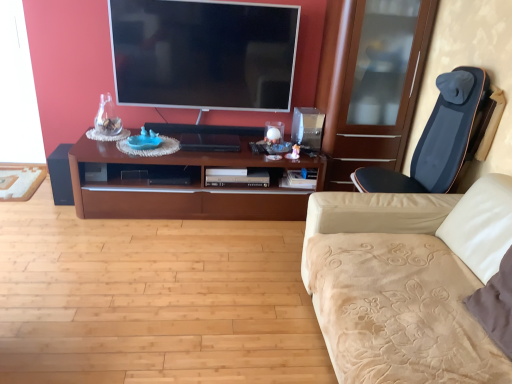
Question: From the image's perspective, would you say black matte speaker at left is positioned over dark blue fabric massage chair at right?

Choices:
 (A) no
 (B) yes

Answer: (A)

Question: Does black matte speaker at left have a lesser height compared to dark blue fabric massage chair at right?

Choices:
 (A) no
 (B) yes

Answer: (B)

Question: Can you confirm if black matte speaker at left is positioned to the right of dark blue fabric massage chair at right?

Choices:
 (A) no
 (B) yes

Answer: (A)

Question: Is dark blue fabric massage chair at right surrounded by black matte speaker at left?

Choices:
 (A) yes
 (B) no

Answer: (B)

Question: Is black matte speaker at left thinner than dark blue fabric massage chair at right?

Choices:
 (A) no
 (B) yes

Answer: (B)

Question: From a real-world perspective, is beige velvety studio couch at right above or below dark blue fabric massage chair at right?

Choices:
 (A) above
 (B) below

Answer: (B)

Question: Looking at the image, does beige velvety studio couch at right seem bigger or smaller compared to dark blue fabric massage chair at right?

Choices:
 (A) small
 (B) big

Answer: (B)

Question: Visually, is beige velvety studio couch at right positioned to the left or to the right of dark blue fabric massage chair at right?

Choices:
 (A) left
 (B) right

Answer: (A)

Question: From their relative heights in the image, would you say beige velvety studio couch at right is taller or shorter than dark blue fabric massage chair at right?

Choices:
 (A) tall
 (B) short

Answer: (A)

Question: Is dark blue fabric massage chair at right in front of or behind black matte speaker at left in the image?

Choices:
 (A) behind
 (B) front

Answer: (B)

Question: Choose the correct answer: Is dark blue fabric massage chair at right inside black matte speaker at left or outside it?

Choices:
 (A) outside
 (B) inside

Answer: (A)

Question: Would you say dark blue fabric massage chair at right is to the left or to the right of black matte speaker at left in the picture?

Choices:
 (A) left
 (B) right

Answer: (B)

Question: In terms of height, does dark blue fabric massage chair at right look taller or shorter compared to black matte speaker at left?

Choices:
 (A) short
 (B) tall

Answer: (B)

Question: In terms of width, does brown wood cabinet at center look wider or thinner when compared to dark blue fabric massage chair at right?

Choices:
 (A) thin
 (B) wide

Answer: (B)

Question: In terms of height, does brown wood cabinet at center look taller or shorter compared to dark blue fabric massage chair at right?

Choices:
 (A) short
 (B) tall

Answer: (A)